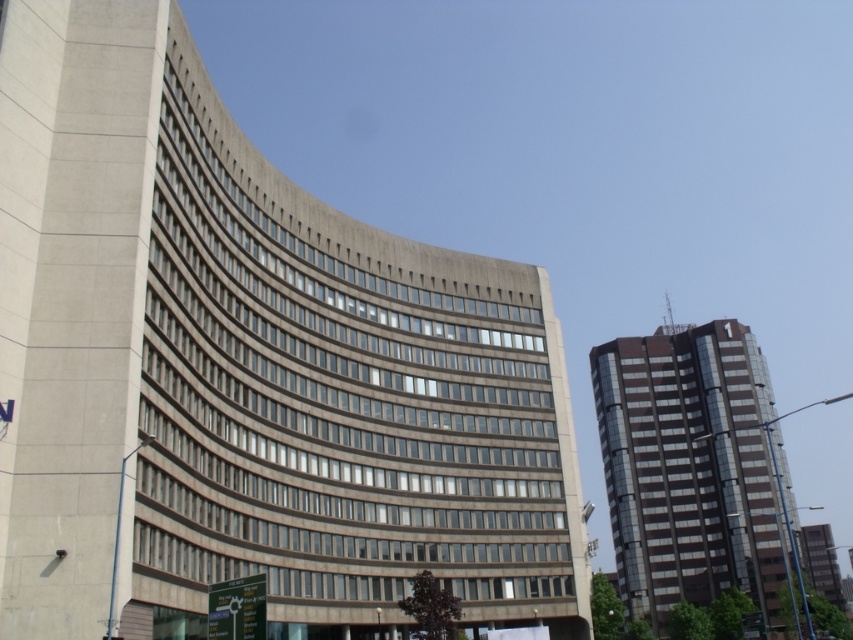
Between concrete building at center and glassy reflective tower at right, which one is positioned lower?

Positioned lower is glassy reflective tower at right.

Can you confirm if concrete building at center is positioned below glassy reflective tower at right?

No.

Who is more forward, (270,264) or (802,550)?

Point (270,264)

The height and width of the screenshot is (640, 853). What are the coordinates of `concrete building at center` in the screenshot? It's located at (248, 371).

Does concrete building at center appear under shiny glass building at right?

Incorrect, concrete building at center is not positioned below shiny glass building at right.

Identify the location of concrete building at center. The image size is (853, 640). (248, 371).

Does point (334, 636) come in front of point (740, 532)?

Yes.

Find the location of a particular element. The width and height of the screenshot is (853, 640). concrete building at center is located at coordinates (248, 371).

Can you confirm if shiny glass building at right is smaller than glassy reflective tower at right?

Incorrect, shiny glass building at right is not smaller in size than glassy reflective tower at right.

The width and height of the screenshot is (853, 640). What do you see at coordinates (692, 467) in the screenshot?
I see `shiny glass building at right` at bounding box center [692, 467].

Is point (711, 358) positioned after point (837, 589)?

That is False.

You are a GUI agent. You are given a task and a screenshot of the screen. Output one action in this format:
    pyautogui.click(x=<x>, y=<y>)
    Task: Click on the shiny glass building at right
    
    Given the screenshot: What is the action you would take?
    pyautogui.click(x=692, y=467)